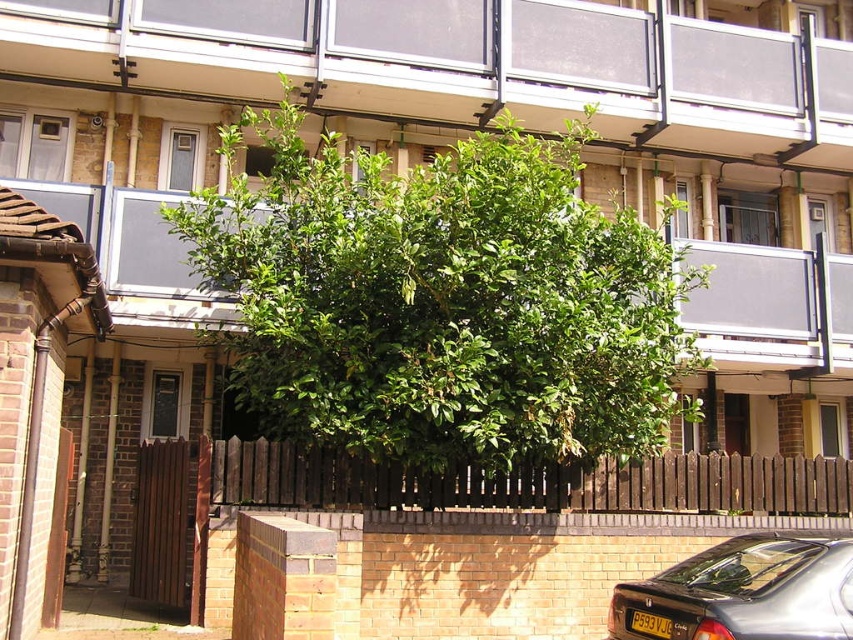
Does green leafy tree at center have a greater width compared to metallic gray car at lower right?

Yes.

Can you confirm if green leafy tree at center is smaller than metallic gray car at lower right?

Actually, green leafy tree at center might be larger than metallic gray car at lower right.

Does point (508, 292) come in front of point (809, 625)?

No, (508, 292) is further to viewer.

Identify the location of green leafy tree at center. The height and width of the screenshot is (640, 853). (442, 301).

Does glass panels at upper center have a lesser height compared to metallic gray car at lower right?

Correct, glass panels at upper center is not as tall as metallic gray car at lower right.

Can you confirm if glass panels at upper center is bigger than metallic gray car at lower right?

No.

Locate an element on the screen. Image resolution: width=853 pixels, height=640 pixels. glass panels at upper center is located at coordinates (466, 65).

Can you confirm if green leafy tree at center is taller than glass panels at upper center?

Yes, green leafy tree at center is taller than glass panels at upper center.

Which is more to the right, green leafy tree at center or glass panels at upper center?

From the viewer's perspective, glass panels at upper center appears more on the right side.

Find the location of `green leafy tree at center`. green leafy tree at center is located at coordinates (442, 301).

Locate an element on the screen. This screenshot has width=853, height=640. green leafy tree at center is located at coordinates (442, 301).